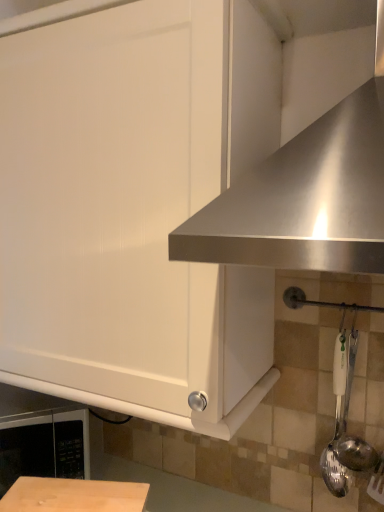
Question: From a real-world perspective, is stainless steel exhaust hood at upper right beneath black matte microwave at lower left?

Choices:
 (A) no
 (B) yes

Answer: (A)

Question: Is stainless steel exhaust hood at upper right turned away from black matte microwave at lower left?

Choices:
 (A) yes
 (B) no

Answer: (B)

Question: Considering the relative sizes of stainless steel exhaust hood at upper right and black matte microwave at lower left in the image provided, is stainless steel exhaust hood at upper right wider than black matte microwave at lower left?

Choices:
 (A) no
 (B) yes

Answer: (B)

Question: From the image's perspective, is stainless steel exhaust hood at upper right above black matte microwave at lower left?

Choices:
 (A) yes
 (B) no

Answer: (A)

Question: From the image's perspective, would you say stainless steel exhaust hood at upper right is shown under black matte microwave at lower left?

Choices:
 (A) yes
 (B) no

Answer: (B)

Question: Considering the relative sizes of stainless steel exhaust hood at upper right and black matte microwave at lower left in the image provided, is stainless steel exhaust hood at upper right shorter than black matte microwave at lower left?

Choices:
 (A) no
 (B) yes

Answer: (A)

Question: Is satin silver spoon at right, acting as the first utensil starting from the left, smaller than black matte microwave at lower left?

Choices:
 (A) no
 (B) yes

Answer: (B)

Question: Can you confirm if satin silver spoon at right, which ranks as the 2th utensil in right-to-left order, is shorter than black matte microwave at lower left?

Choices:
 (A) no
 (B) yes

Answer: (A)

Question: Is the depth of satin silver spoon at right, which ranks as the 2th utensil in right-to-left order, less than that of black matte microwave at lower left?

Choices:
 (A) yes
 (B) no

Answer: (A)

Question: Is satin silver spoon at right, which ranks as the 2th utensil in right-to-left order, positioned behind black matte microwave at lower left?

Choices:
 (A) no
 (B) yes

Answer: (A)

Question: Is satin silver spoon at right, which ranks as the 2th utensil in right-to-left order, wider than black matte microwave at lower left?

Choices:
 (A) yes
 (B) no

Answer: (B)

Question: Is satin silver spoon at right, which ranks as the 2th utensil in right-to-left order, not near black matte microwave at lower left?

Choices:
 (A) yes
 (B) no

Answer: (B)

Question: Does satin silver spoon at right, acting as the first utensil starting from the left, have a greater height compared to white matte cabinet at upper left?

Choices:
 (A) no
 (B) yes

Answer: (A)